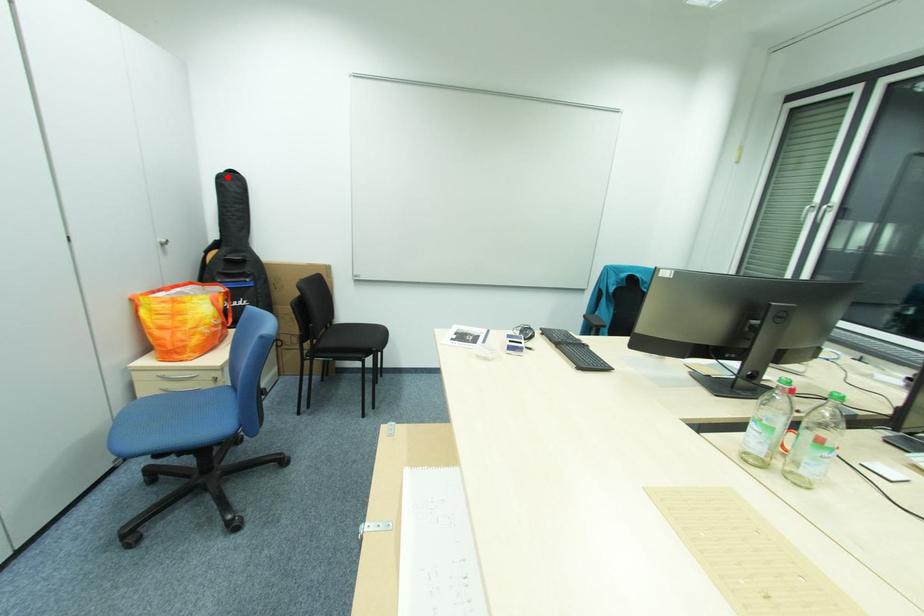
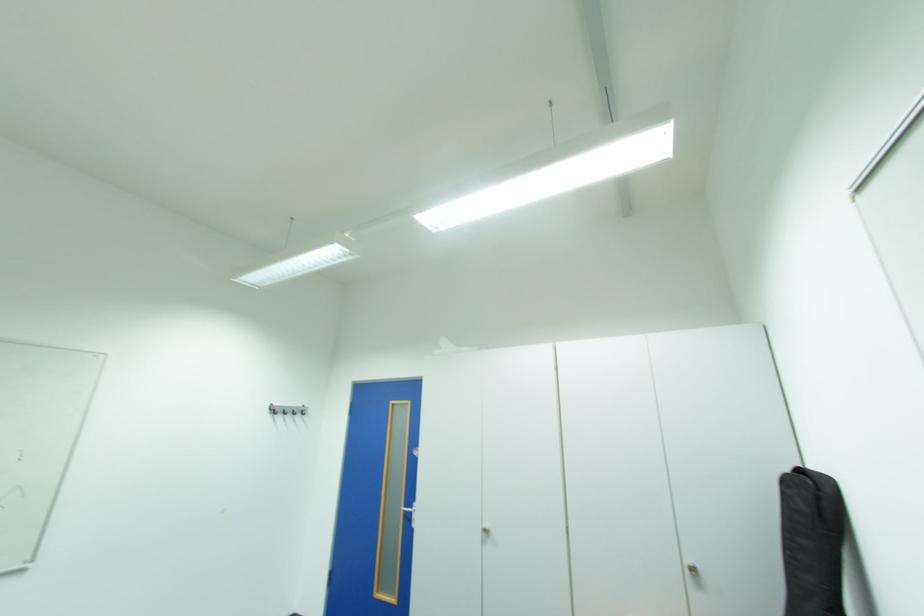
The point at the highlighted location is marked in the first image. Where is the corresponding point in the second image?

(795, 482)